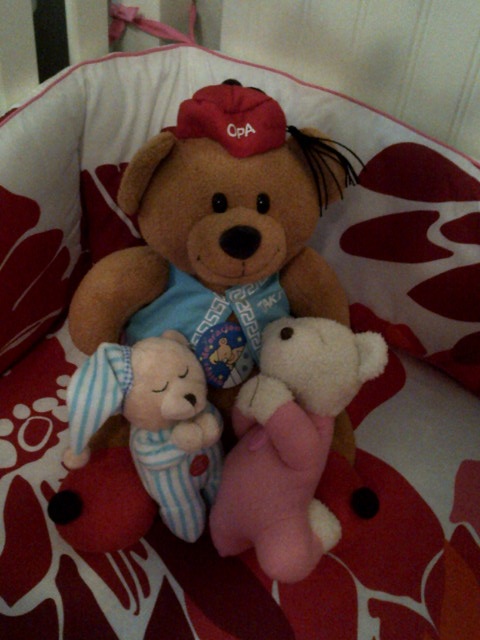
Find the location of a particular element. tassle is located at coordinates (310, 146).